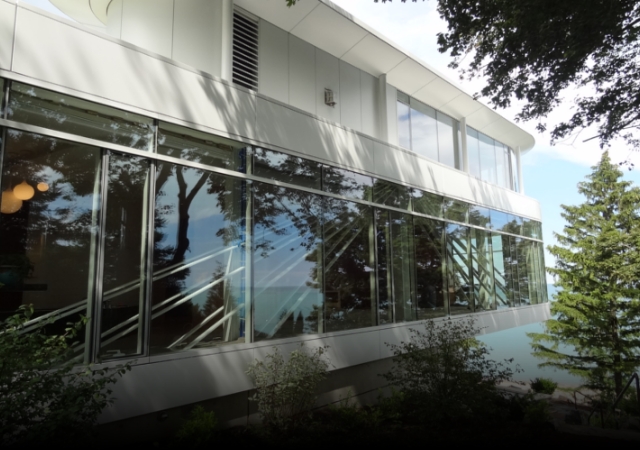
You are a GUI agent. You are given a task and a screenshot of the screen. Output one action in this format:
    pyautogui.click(x=<x>, y=<y>)
    Task: Click on the light dots
    
    Given the screenshot: What is the action you would take?
    pyautogui.click(x=27, y=209)